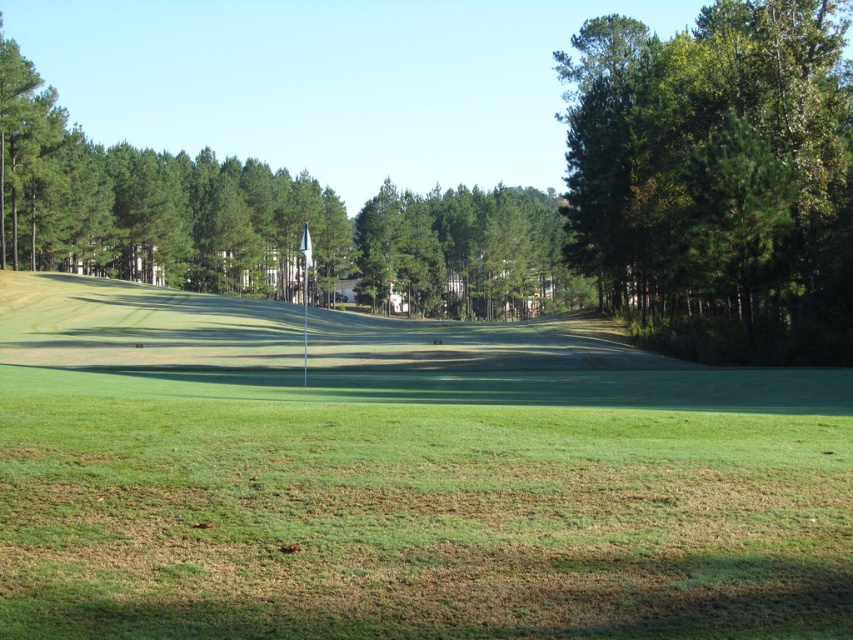
Which is above, green grass at center or green leafy tree at upper right?

green leafy tree at upper right is above.

Which is behind, point (225, 428) or point (737, 205)?

Positioned behind is point (737, 205).

Which is behind, point (282, 572) or point (746, 147)?

The point (746, 147) is more distant.

You are a GUI agent. You are given a task and a screenshot of the screen. Output one action in this format:
    pyautogui.click(x=<x>, y=<y>)
    Task: Click on the green grass at center
    
    Given the screenshot: What is the action you would take?
    pyautogui.click(x=402, y=476)